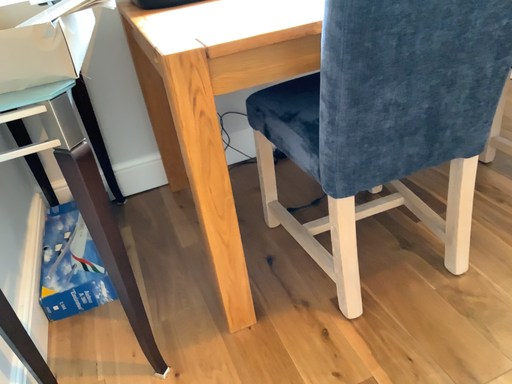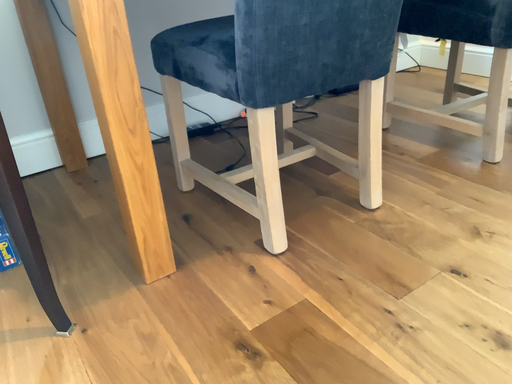
Question: How did the camera likely rotate when shooting the video?

Choices:
 (A) rotated right
 (B) rotated left

Answer: (A)